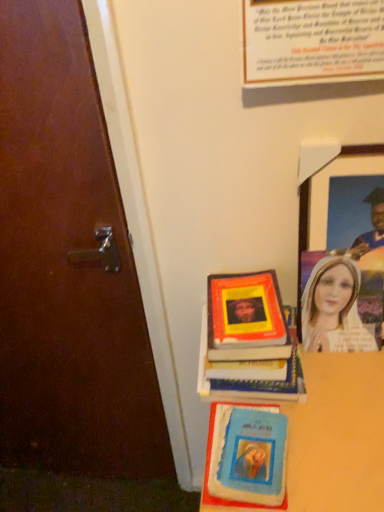
The height and width of the screenshot is (512, 384). I want to click on unoccupied area in front of wooden picture frame at upper right, so click(x=342, y=397).